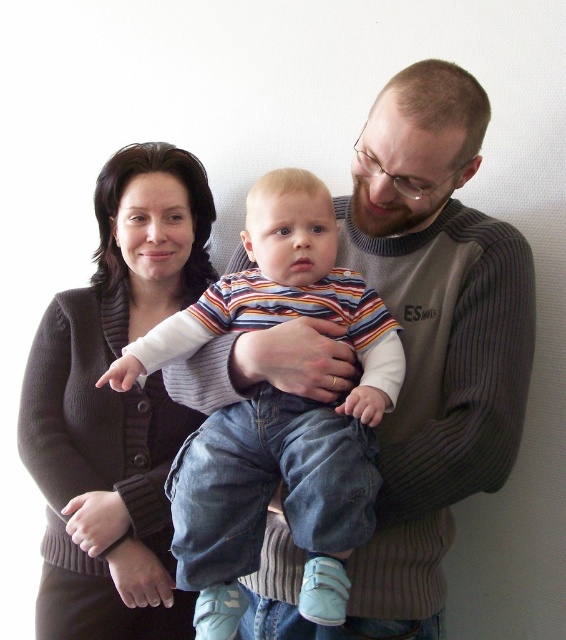
You are a photographer setting up a backdrop for a family photo. The scene includes a striped cotton shirt at center and a dark brown sweater at center. To ensure both items are clearly visible, you need to know which one is wider. Can you determine which item is wider?

The striped cotton shirt at center might be wider than dark brown sweater at center according to the description, so it is likely the striped cotton shirt at center is wider.

Based on the scene description, where is the striped cotton shirt at center located in the image?

The striped cotton shirt at center is located at point 0.648 on the x axis and 0.489 on the y axis.